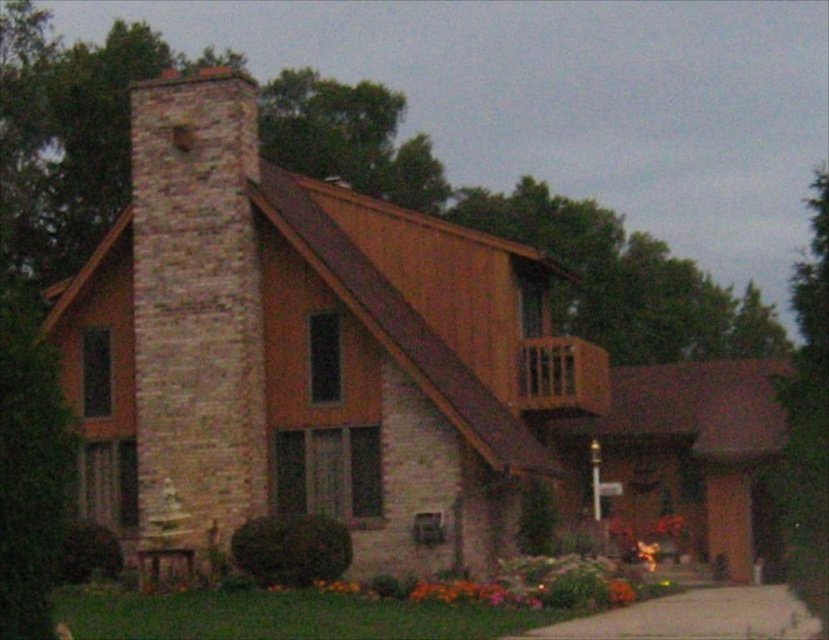
Image resolution: width=829 pixels, height=640 pixels. What do you see at coordinates (196, 314) in the screenshot?
I see `brick chimney at left` at bounding box center [196, 314].

Is point (139, 269) closer to camera compared to point (575, 614)?

No, it is behind (575, 614).

Is point (224, 438) positioned after point (434, 608)?

Yes, it is.

Where is `brick chimney at left`? Image resolution: width=829 pixels, height=640 pixels. brick chimney at left is located at coordinates (196, 314).